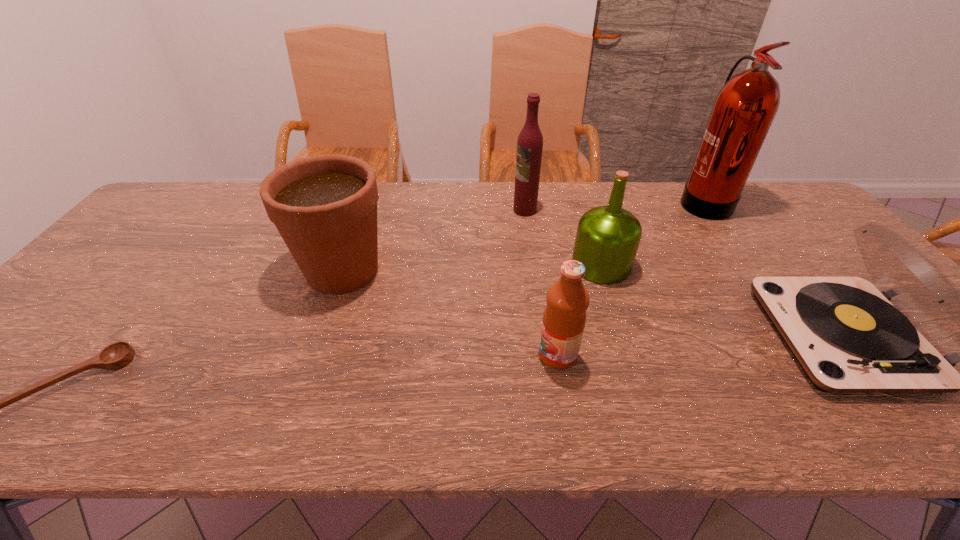
The height and width of the screenshot is (540, 960). In order to click on the tallest object in this screenshot , I will do `click(744, 109)`.

The image size is (960, 540). Find the location of `liquor`. liquor is located at coordinates (530, 140).

The image size is (960, 540). Identify the location of olive oil. (607, 239).

Where is `the second object from left to right`? Image resolution: width=960 pixels, height=540 pixels. the second object from left to right is located at coordinates (325, 206).

Find the location of `fruit juice`. fruit juice is located at coordinates (564, 318).

Where is `vacant space located 0.130m on the front-facing side of the tallest object`? vacant space located 0.130m on the front-facing side of the tallest object is located at coordinates (638, 201).

This screenshot has width=960, height=540. Find the location of `vacant point located 0.310m on the front-facing side of the tallest object`. vacant point located 0.310m on the front-facing side of the tallest object is located at coordinates (585, 201).

Where is `free space located 0.120m on the front-facing side of the tallest object`? The width and height of the screenshot is (960, 540). free space located 0.120m on the front-facing side of the tallest object is located at coordinates (641, 201).

At what (x,y) coordinates should I click in order to perform the action: click on vacant space located on the label of the second tallest object. Please return your answer as a coordinate pair (x, y). The width and height of the screenshot is (960, 540). Looking at the image, I should click on (486, 210).

You are a GUI agent. You are given a task and a screenshot of the screen. Output one action in this format:
    pyautogui.click(x=<x>, y=<y>)
    Task: Click on the vacant area located 0.080m on the label of the second tallest object
    The height and width of the screenshot is (540, 960).
    Given the screenshot: What is the action you would take?
    click(x=489, y=210)